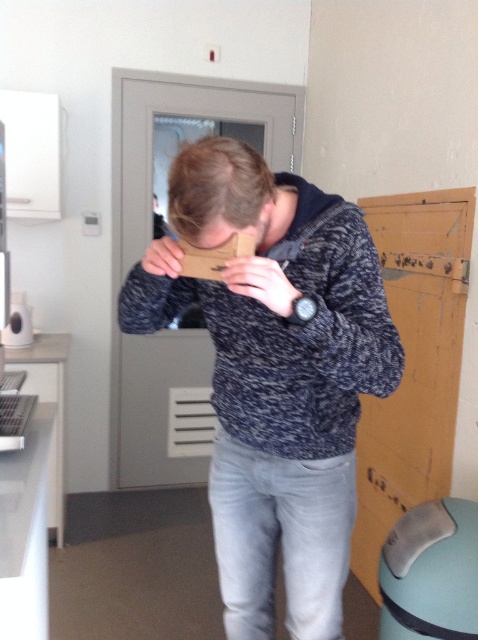
From the picture: You are trying to see the matte cardboard at center behind the brown cardboard at center. Can you see it clearly?

The brown cardboard at center is closer to the viewer than the matte cardboard at center, so the matte cardboard at center is partially obscured and not clearly visible.

You are the person in the image holding a matte brown paper at center and a matte cardboard at center in front of your face. Which object is closer to your left side?

The matte brown paper at center is closer to your left side because it is positioned to the left of the matte cardboard at center.

You are trying to see the door behind the person holding the matte brown paper at center and the matte cardboard at center. Which object is blocking your view of the door more?

The matte cardboard at center is blocking your view more because the matte brown paper at center is below it, so the cardboard is higher up and likely covering more of the door.